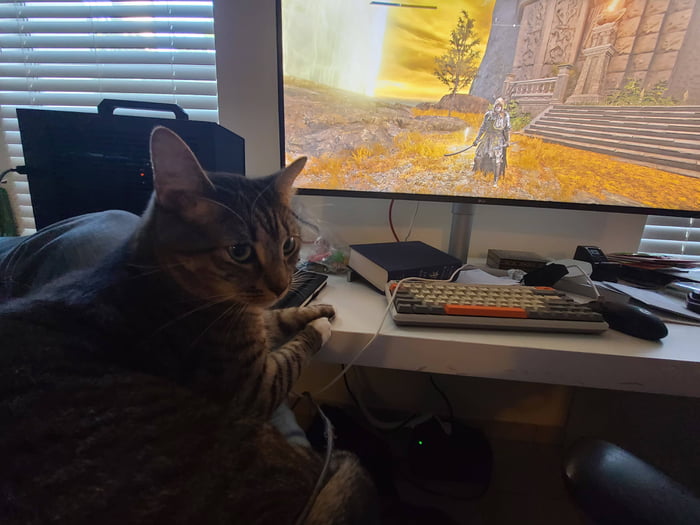
This screenshot has height=525, width=700. I want to click on arm of chair, so click(x=594, y=468).